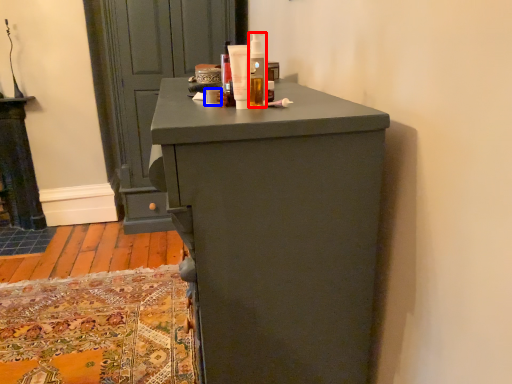
Question: Among these objects, which one is farthest to the camera, toiletry (highlighted by a red box) or toiletry (highlighted by a blue box)?

Choices:
 (A) toiletry
 (B) toiletry

Answer: (B)